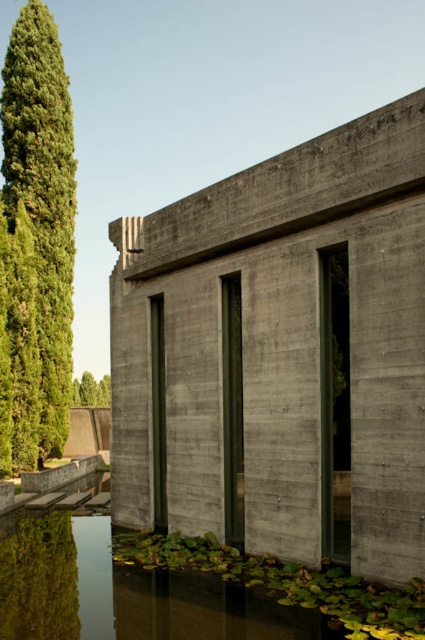
Question: Which object appears farthest from the camera in this image?

Choices:
 (A) green mossy water at lower center
 (B) green textured tree at left

Answer: (B)

Question: Which of the following is the farthest from the observer?

Choices:
 (A) green leafy tree at upper left
 (B) green textured tree at left
 (C) gray concrete wall at center
 (D) green mossy water at lower center

Answer: (A)

Question: Does green textured tree at left come in front of green leafy tree at upper left?

Choices:
 (A) yes
 (B) no

Answer: (A)

Question: Which point is closer to the camera?

Choices:
 (A) (10, 605)
 (B) (68, 218)
 (C) (294, 474)

Answer: (A)

Question: Can you confirm if green textured tree at left is bigger than green leafy tree at upper left?

Choices:
 (A) no
 (B) yes

Answer: (B)

Question: Is gray concrete wall at center bigger than green mossy water at lower center?

Choices:
 (A) no
 (B) yes

Answer: (B)